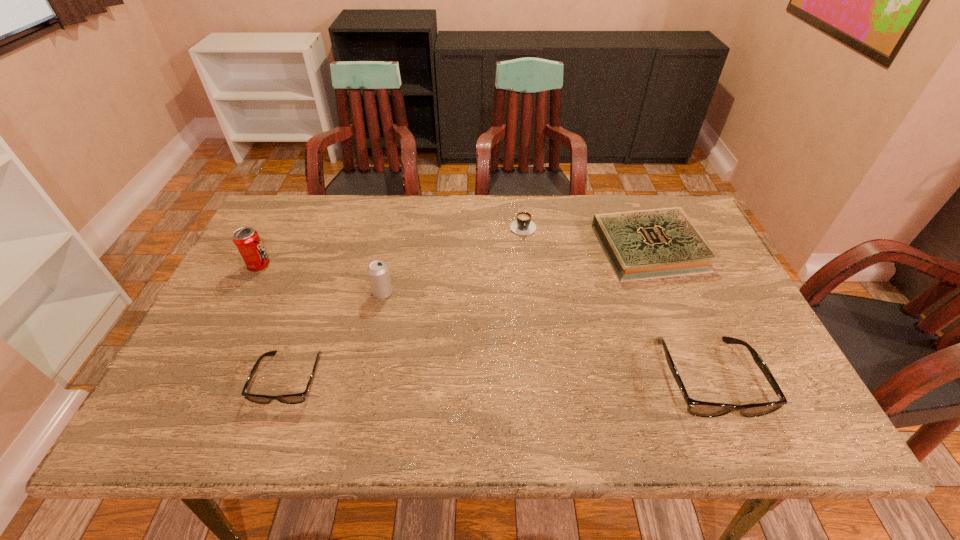
Where is `vacant region located 0.140m with the handle on the side of the fourth object from left to right`? The image size is (960, 540). vacant region located 0.140m with the handle on the side of the fourth object from left to right is located at coordinates (527, 268).

Identify the location of free region located on the front of the second tallest object. (368, 364).

You are a GUI agent. You are given a task and a screenshot of the screen. Output one action in this format:
    pyautogui.click(x=<x>, y=<y>)
    Task: Click on the vacant area situated 0.050m on the back of the hardback book
    The width and height of the screenshot is (960, 540).
    Given the screenshot: What is the action you would take?
    pyautogui.click(x=635, y=210)

Where is `vacant space located on the front of the leftmost object`? This screenshot has height=540, width=960. vacant space located on the front of the leftmost object is located at coordinates (198, 383).

Where is `cappuccino that is at the far edge`? The height and width of the screenshot is (540, 960). cappuccino that is at the far edge is located at coordinates (523, 225).

You are a GUI agent. You are given a task and a screenshot of the screen. Output one action in this format:
    pyautogui.click(x=<x>, y=<y>)
    Task: Click on the hardback book located at the far edge
    
    Given the screenshot: What is the action you would take?
    pyautogui.click(x=646, y=244)

Identify the location of object that is at the left edge. The width and height of the screenshot is (960, 540). (246, 240).

You are a GUI agent. You are given a task and a screenshot of the screen. Output one action in this format:
    pyautogui.click(x=<x>, y=<y>)
    Task: Click on the spectacles located in the right edge section of the desktop
    The image size is (960, 540).
    Given the screenshot: What is the action you would take?
    [697, 408]

Where is `hardback book located in the right edge section of the desktop`? This screenshot has height=540, width=960. hardback book located in the right edge section of the desktop is located at coordinates (646, 244).

Where is `object present at the far right corner`? The height and width of the screenshot is (540, 960). object present at the far right corner is located at coordinates (646, 244).